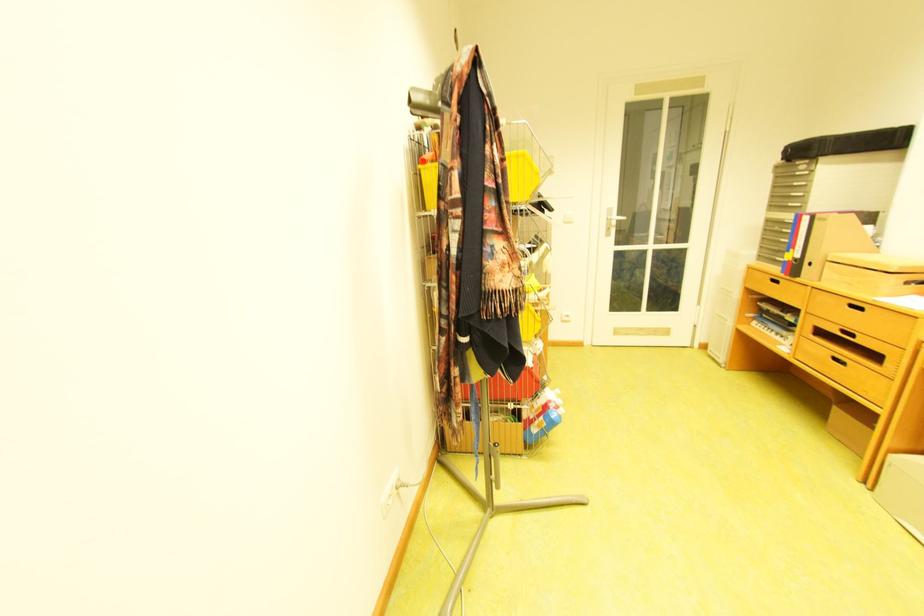
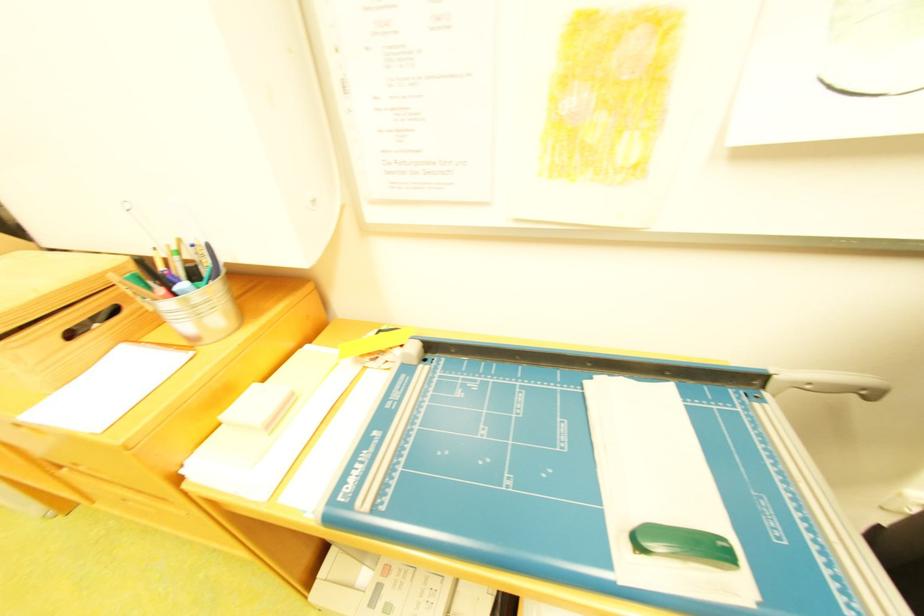
Question: I am providing you with two images of the same scene from different viewpoints. Please identify which objects are invisible in image2.

Choices:
 (A) paper cutter handle
 (B) wooden drawer handle
 (C) metal pot handle
 (D) drawer handle

Answer: (B)